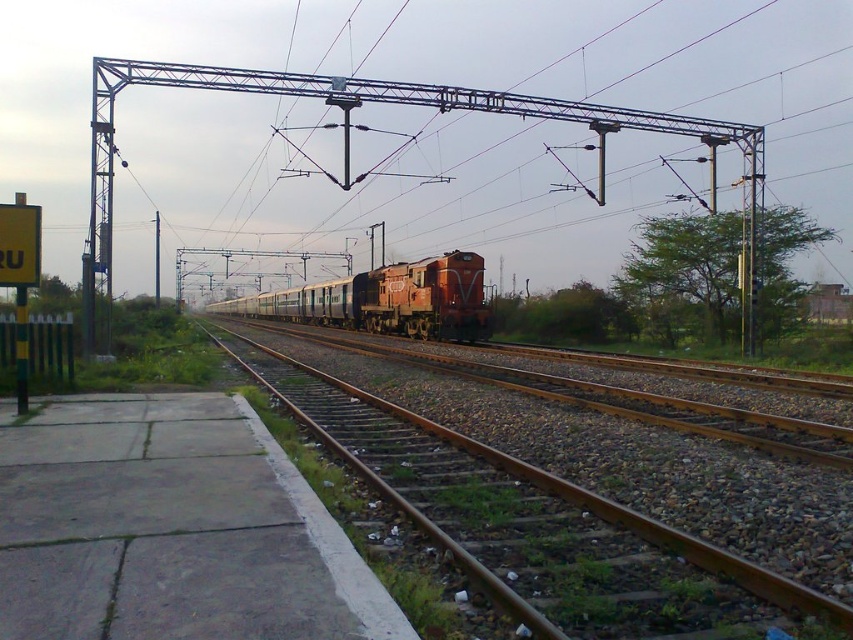
Question: Does brown metal train track at center have a larger size compared to metallic pole at left?

Choices:
 (A) no
 (B) yes

Answer: (A)

Question: Which point is closer to the camera?

Choices:
 (A) (683, 544)
 (B) (157, 266)
 (C) (349, 292)

Answer: (A)

Question: Which object is positioned closest to the matte red locomotive at center?

Choices:
 (A) brown metal train track at center
 (B) metallic pole at left

Answer: (B)

Question: Considering the real-world distances, which object is farthest from the brown metal train track at center?

Choices:
 (A) matte red locomotive at center
 (B) metallic pole at left

Answer: (B)

Question: Can you confirm if brown metal train track at center is bigger than metallic pole at left?

Choices:
 (A) no
 (B) yes

Answer: (A)

Question: Does brown metal train track at center have a larger size compared to metallic pole at left?

Choices:
 (A) no
 (B) yes

Answer: (A)